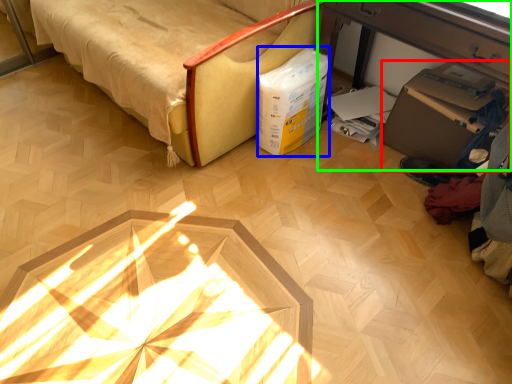
Question: Estimate the real-world distances between objects in this image. Which object is closer to cardboard box (highlighted by a red box), box (highlighted by a blue box) or table (highlighted by a green box)?

Choices:
 (A) box
 (B) table

Answer: (B)